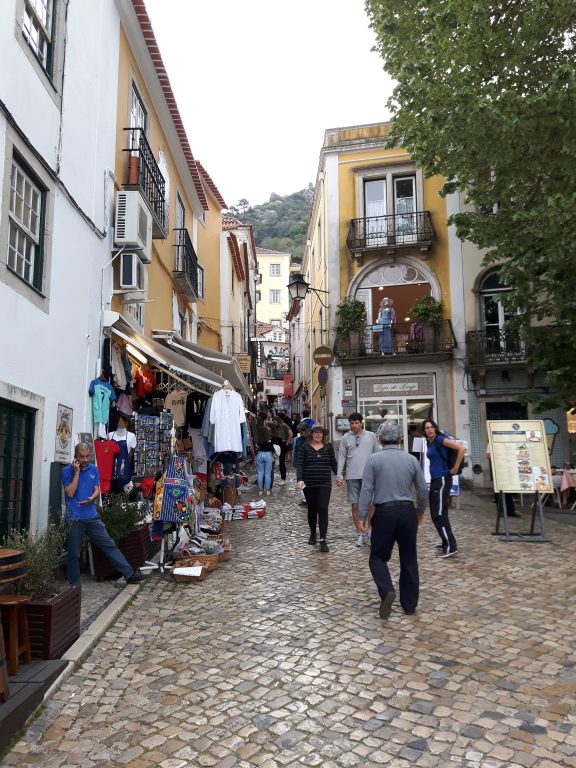
The image size is (576, 768). In order to click on plant in this screenshot , I will do `click(44, 565)`.